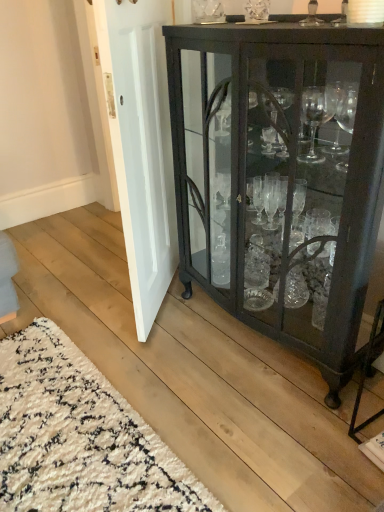
Question: Is white shaggy rug at lower left smaller than white painted wood door at center?

Choices:
 (A) no
 (B) yes

Answer: (B)

Question: Is white painted wood door at center located within white shaggy rug at lower left?

Choices:
 (A) yes
 (B) no

Answer: (B)

Question: From the image's perspective, is white shaggy rug at lower left below white painted wood door at center?

Choices:
 (A) no
 (B) yes

Answer: (B)

Question: Can you confirm if white shaggy rug at lower left is taller than white painted wood door at center?

Choices:
 (A) yes
 (B) no

Answer: (B)

Question: Considering the relative sizes of white shaggy rug at lower left and white painted wood door at center in the image provided, is white shaggy rug at lower left thinner than white painted wood door at center?

Choices:
 (A) no
 (B) yes

Answer: (A)

Question: Can you confirm if white shaggy rug at lower left is shorter than white painted wood door at center?

Choices:
 (A) yes
 (B) no

Answer: (A)

Question: Considering the relative sizes of matte black cabinet at right and white shaggy rug at lower left in the image provided, is matte black cabinet at right smaller than white shaggy rug at lower left?

Choices:
 (A) yes
 (B) no

Answer: (B)

Question: Is matte black cabinet at right oriented towards white shaggy rug at lower left?

Choices:
 (A) no
 (B) yes

Answer: (B)

Question: Is matte black cabinet at right positioned before white shaggy rug at lower left?

Choices:
 (A) no
 (B) yes

Answer: (B)

Question: From a real-world perspective, is matte black cabinet at right located beneath white shaggy rug at lower left?

Choices:
 (A) yes
 (B) no

Answer: (B)

Question: Is matte black cabinet at right facing away from white shaggy rug at lower left?

Choices:
 (A) no
 (B) yes

Answer: (A)

Question: Are matte black cabinet at right and white shaggy rug at lower left located far from each other?

Choices:
 (A) no
 (B) yes

Answer: (A)

Question: From the image's perspective, is matte black cabinet at right located above white painted wood door at center?

Choices:
 (A) yes
 (B) no

Answer: (B)